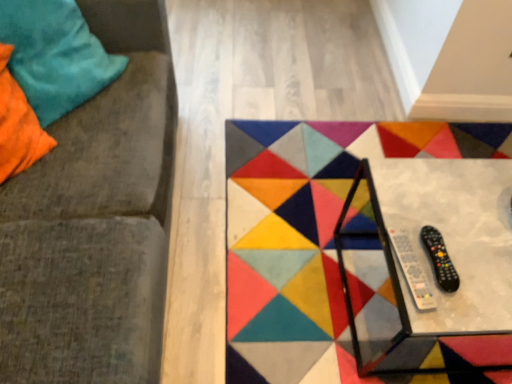
Question: Can you confirm if velvety teal pillow at upper left is bigger than metallic glass table at center?

Choices:
 (A) yes
 (B) no

Answer: (B)

Question: Does velvety teal pillow at upper left come in front of metallic glass table at center?

Choices:
 (A) yes
 (B) no

Answer: (B)

Question: Does velvety teal pillow at upper left touch metallic glass table at center?

Choices:
 (A) no
 (B) yes

Answer: (A)

Question: From a real-world perspective, is velvety teal pillow at upper left positioned over metallic glass table at center based on gravity?

Choices:
 (A) yes
 (B) no

Answer: (A)

Question: From the image's perspective, is velvety teal pillow at upper left located beneath metallic glass table at center?

Choices:
 (A) yes
 (B) no

Answer: (B)

Question: Is black plastic remote at lower right taller or shorter than velvet cushion at left?

Choices:
 (A) short
 (B) tall

Answer: (A)

Question: From a real-world perspective, is black plastic remote at lower right above or below velvet cushion at left?

Choices:
 (A) below
 (B) above

Answer: (A)

Question: Is black plastic remote at lower right wider or thinner than velvet cushion at left?

Choices:
 (A) thin
 (B) wide

Answer: (A)

Question: Does point (411, 281) appear closer or farther from the camera than point (6, 208)?

Choices:
 (A) farther
 (B) closer

Answer: (B)

Question: Would you say velvet cushion at left is to the left or to the right of black plastic remote control at lower right in the picture?

Choices:
 (A) right
 (B) left

Answer: (B)

Question: Is velvet cushion at left wider or thinner than black plastic remote control at lower right?

Choices:
 (A) thin
 (B) wide

Answer: (B)

Question: Relative to black plastic remote control at lower right, is velvet cushion at left in front or behind?

Choices:
 (A) behind
 (B) front

Answer: (B)

Question: In terms of height, does velvet cushion at left look taller or shorter compared to black plastic remote control at lower right?

Choices:
 (A) short
 (B) tall

Answer: (B)

Question: Relative to black plastic remote at lower right, is velvety teal pillow at upper left in front or behind?

Choices:
 (A) behind
 (B) front

Answer: (A)

Question: Is velvety teal pillow at upper left bigger or smaller than black plastic remote at lower right?

Choices:
 (A) big
 (B) small

Answer: (A)